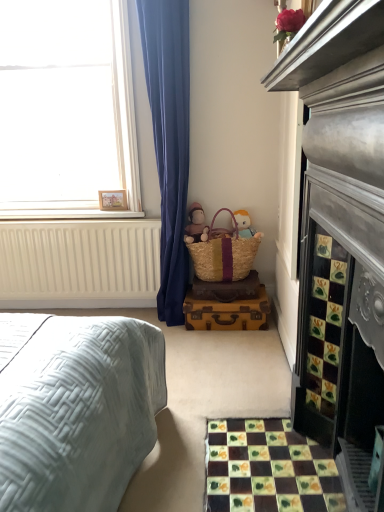
Locate an element on the screen. The height and width of the screenshot is (512, 384). woven straw picnic basket at lower center is located at coordinates (223, 255).

What do you see at coordinates (196, 224) in the screenshot? The width and height of the screenshot is (384, 512). I see `matte pink plush at center` at bounding box center [196, 224].

Identify the location of matte pink plush at center. The width and height of the screenshot is (384, 512). (196, 224).

What do you see at coordinates (66, 109) in the screenshot?
I see `white matte window at upper left` at bounding box center [66, 109].

I want to click on beige wicker basket at center, so click(245, 225).

Locate an element on the screen. The image size is (384, 512). woven straw picnic basket at lower center is located at coordinates (223, 255).

Which of these two, white matte window at upper left or woven straw picnic basket at lower center, stands taller?

white matte window at upper left is taller.

Is white matte window at upper left located outside woven straw picnic basket at lower center?

Absolutely, white matte window at upper left is external to woven straw picnic basket at lower center.

Which object is further away from the camera, white matte window at upper left or woven straw picnic basket at lower center?

woven straw picnic basket at lower center.

Considering the sizes of white matte window at upper left and woven straw picnic basket at lower center in the image, is white matte window at upper left wider or thinner than woven straw picnic basket at lower center?

In the image, white matte window at upper left appears to be wider than woven straw picnic basket at lower center.

You are a GUI agent. You are given a task and a screenshot of the screen. Output one action in this format:
    pyautogui.click(x=<x>, y=<y>)
    Task: Click on the toy on the right of wooden frame at upper left
    The image size is (384, 512).
    Given the screenshot: What is the action you would take?
    (x=245, y=225)

Considering the positions of point (250, 230) and point (111, 203), is point (250, 230) closer or farther from the camera than point (111, 203)?

Point (250, 230) is closer to the camera than point (111, 203).

Based on the photo, from a real-world perspective, who is located higher, beige wicker basket at center or wooden frame at upper left?

wooden frame at upper left is physically above.

Between beige wicker basket at center and wooden frame at upper left, which one has less height?

With less height is wooden frame at upper left.

Is multicolored mosaic tiles at lower right aimed at white matte window at upper left?

No, multicolored mosaic tiles at lower right is not turned towards white matte window at upper left.

Is multicolored mosaic tiles at lower right bigger or smaller than white matte window at upper left?

Result: Clearly, multicolored mosaic tiles at lower right is smaller in size than white matte window at upper left.

Relative to white matte window at upper left, is multicolored mosaic tiles at lower right in front or behind?

multicolored mosaic tiles at lower right is in front of white matte window at upper left.

Is point (276, 463) positioned in front of point (101, 213)?

Yes, it is.

From the image's perspective, which one is positioned lower, matte pink plush at center or white painted wood at upper left?

matte pink plush at center is shown below in the image.

Measure the distance between matte pink plush at center and white painted wood at upper left.

They are 24.35 inches apart.

Identify the location of doll lying on the right of white painted wood at upper left. The width and height of the screenshot is (384, 512). (196, 224).

Between beige wicker basket at center and woven straw picnic basket at lower center, which one appears on the right side from the viewer's perspective?

From the viewer's perspective, beige wicker basket at center appears more on the right side.

Measure the distance between beige wicker basket at center and woven straw picnic basket at lower center.

beige wicker basket at center and woven straw picnic basket at lower center are 6.87 inches apart from each other.

Which is behind, point (257, 234) or point (241, 260)?

The point (257, 234) is farther from the camera.

Can you see beige wicker basket at center touching woven straw picnic basket at lower center?

No, beige wicker basket at center is not with woven straw picnic basket at lower center.

Does point (222, 507) appear closer or farther from the camera than point (120, 205)?

Point (222, 507) is closer to the camera than point (120, 205).

Relative to wooden frame at upper left, is multicolored mosaic tiles at lower right in front or behind?

Clearly, multicolored mosaic tiles at lower right is in front of wooden frame at upper left.

From the image's perspective, between multicolored mosaic tiles at lower right and wooden frame at upper left, who is located below?

multicolored mosaic tiles at lower right appears lower in the image.

Does multicolored mosaic tiles at lower right have a greater width compared to wooden frame at upper left?

Correct, the width of multicolored mosaic tiles at lower right exceeds that of wooden frame at upper left.

Does point (103, 206) appear closer or farther from the camera than point (187, 239)?

Point (103, 206) is positioned farther from the camera compared to point (187, 239).

Consider the image. Is wooden frame at upper left not close to matte pink plush at center?

wooden frame at upper left is actually quite close to matte pink plush at center.

From the image's perspective, between wooden frame at upper left and matte pink plush at center, which one is located above?

wooden frame at upper left, from the image's perspective.

Could matte pink plush at center be considered to be inside wooden frame at upper left?

No, matte pink plush at center is not a part of wooden frame at upper left.

Identify the location of picnic basket behind the white matte window at upper left. The height and width of the screenshot is (512, 384). (223, 255).

The width and height of the screenshot is (384, 512). I want to click on toy on the right of wooden frame at upper left, so click(245, 225).

Considering their positions, is beige wicker basket at center positioned closer to multicolored mosaic tiles at lower right than wooden frame at upper left?

beige wicker basket at center.

When comparing their distances from multicolored mosaic tiles at lower right, does beige wicker basket at center or white painted wood at upper left seem further?

white painted wood at upper left lies further to multicolored mosaic tiles at lower right than the other object.

Based on their spatial positions, is white painted wood at upper left or white matte window at upper left further from woven straw picnic basket at lower center?

white matte window at upper left is further to woven straw picnic basket at lower center.

Based on their spatial positions, is white painted wood at upper left or multicolored mosaic tiles at lower right further from wooden frame at upper left?

Among the two, multicolored mosaic tiles at lower right is located further to wooden frame at upper left.

When comparing their distances from white matte window at upper left, does white painted wood at upper left or woven straw picnic basket at lower center seem closer?

Among the two, white painted wood at upper left is located nearer to white matte window at upper left.

Based on their spatial positions, is white painted wood at upper left or wooden frame at upper left further from matte pink plush at center?

white painted wood at upper left lies further to matte pink plush at center than the other object.

Estimate the real-world distances between objects in this image. Which object is further from matte pink plush at center, wooden frame at upper left or beige wicker basket at center?

The object further to matte pink plush at center is wooden frame at upper left.

Considering their positions, is beige wicker basket at center positioned further to matte pink plush at center than white painted wood at upper left?

white painted wood at upper left.

Locate an element on the screen. The image size is (384, 512). picnic basket between white painted wood at upper left and beige wicker basket at center is located at coordinates (223, 255).

This screenshot has width=384, height=512. I want to click on doll between multicolored mosaic tiles at lower right and beige wicker basket at center in the front-back direction, so click(196, 224).

The height and width of the screenshot is (512, 384). Identify the location of doll between white painted wood at upper left and beige wicker basket at center from left to right. (196, 224).

Locate an element on the screen. The image size is (384, 512). picnic basket located between white matte window at upper left and beige wicker basket at center in the left-right direction is located at coordinates (223, 255).